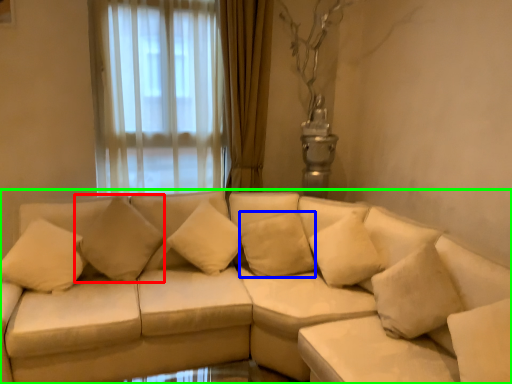
Question: Estimate the real-world distances between objects in this image. Which object is closer to pillow (highlighted by a red box), pillow (highlighted by a blue box) or studio couch (highlighted by a green box)?

Choices:
 (A) pillow
 (B) studio couch

Answer: (B)